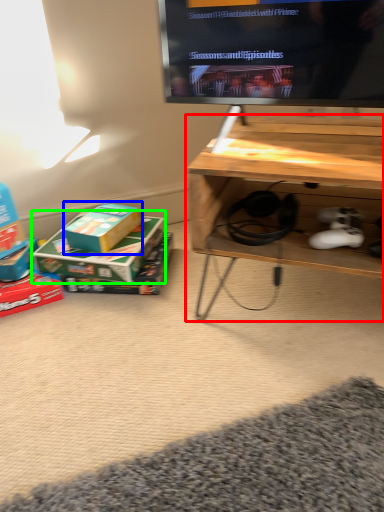
Question: Which object is positioned farthest from table (highlighted by a red box)? Select from box (highlighted by a blue box) and box (highlighted by a green box).

Choices:
 (A) box
 (B) box

Answer: (A)